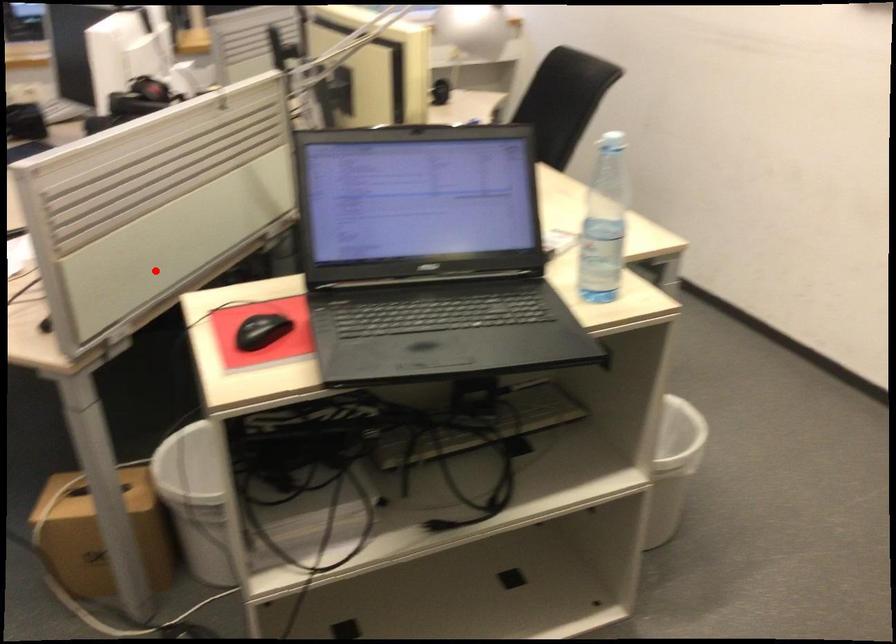
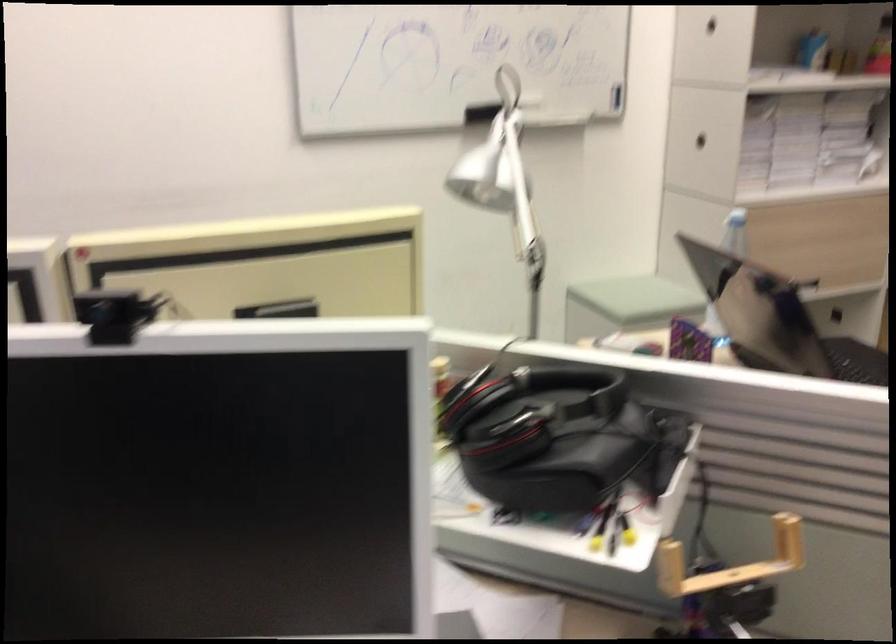
Where in the second image is the point corresponding to the highlighted location from the first image?

(730, 562)